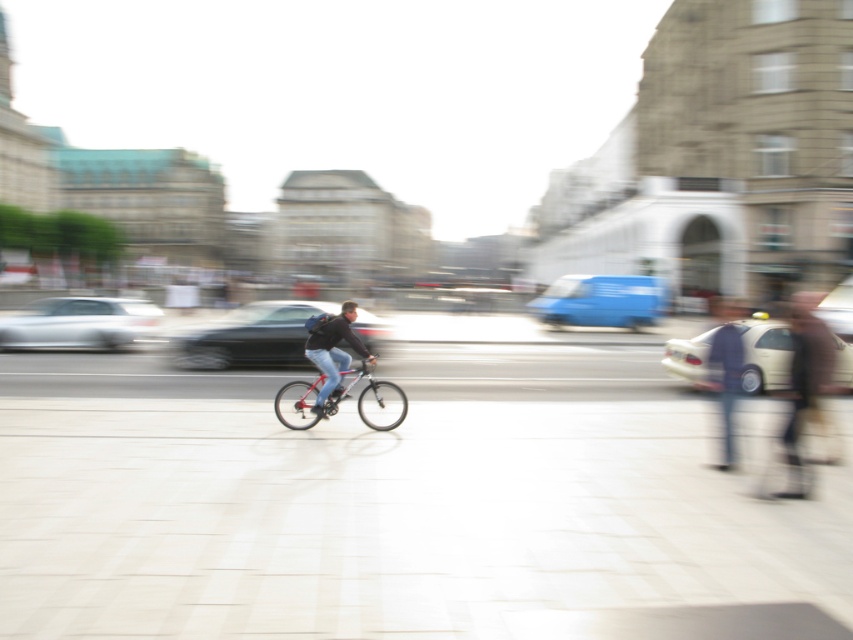
Question: Does silver metallic sedan at left appear on the right side of matte black jacket at center?

Choices:
 (A) no
 (B) yes

Answer: (A)

Question: Which point appears closest to the camera in this image?

Choices:
 (A) (461, 604)
 (B) (337, 394)
 (C) (659, 316)

Answer: (A)

Question: From the image, what is the correct spatial relationship of white tile pavement at center in relation to metallic silver bicycle at center?

Choices:
 (A) left
 (B) right

Answer: (B)

Question: Which point is closer to the camera?

Choices:
 (A) (695, 365)
 (B) (366, 360)
 (C) (590, 292)
 (D) (97, 312)

Answer: (B)

Question: Which point is closer to the camera?

Choices:
 (A) (708, 356)
 (B) (198, 340)
 (C) (747, 342)
 (D) (621, 284)

Answer: (A)

Question: Can you confirm if blue matte van at center is smaller than dark blue jeans at right?

Choices:
 (A) yes
 (B) no

Answer: (A)